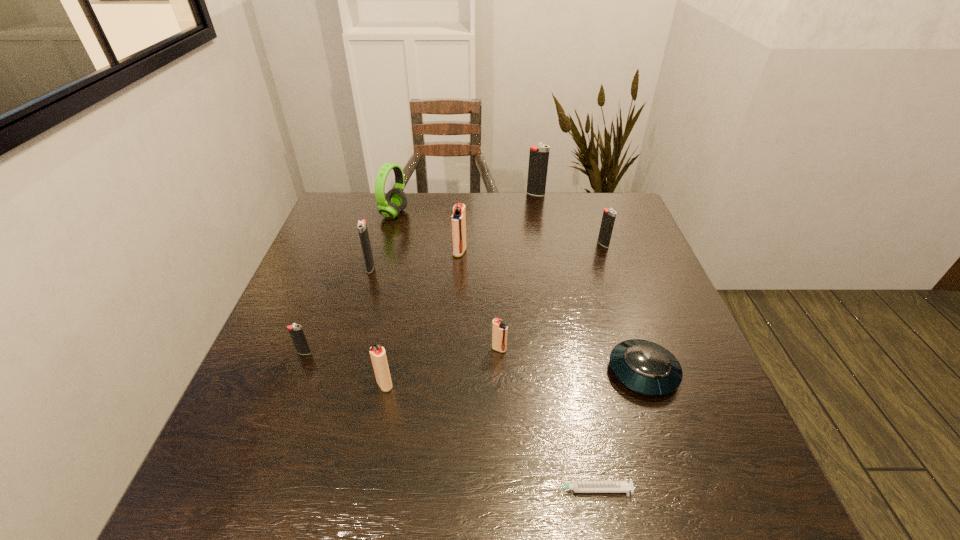
You are a GUI agent. You are given a task and a screenshot of the screen. Output one action in this format:
    pyautogui.click(x=<x>, y=<y>)
    Task: Click on the vacant point located on the right of the biggest black igniter
    
    Given the screenshot: What is the action you would take?
    pyautogui.click(x=598, y=194)

Where is `vacant point located 0.130m on the front of the ninth nearest object`? This screenshot has height=540, width=960. vacant point located 0.130m on the front of the ninth nearest object is located at coordinates (384, 252).

What are the coordinates of `vacant space located 0.270m on the right of the biggest red igniter` in the screenshot? It's located at (563, 252).

Find the location of a particular element. vacant space situated 0.340m on the right of the second nearest black igniter is located at coordinates pos(500,267).

Identify the location of free spot located on the front of the third nearest black igniter. The width and height of the screenshot is (960, 540). (634, 332).

Locate an element on the screen. The width and height of the screenshot is (960, 540). vacant space positioned on the back of the second biggest red igniter is located at coordinates (409, 260).

In order to click on free spot located 0.280m on the front of the sixth object from left to right in this screenshot , I will do `click(505, 481)`.

Where is `vacant area located on the back of the smallest black igniter`? vacant area located on the back of the smallest black igniter is located at coordinates (329, 287).

I want to click on vacant space located 0.220m on the back of the ninth tallest object, so click(612, 281).

Identify the location of free location located 0.230m at the needle end of the nearest object. (408, 490).